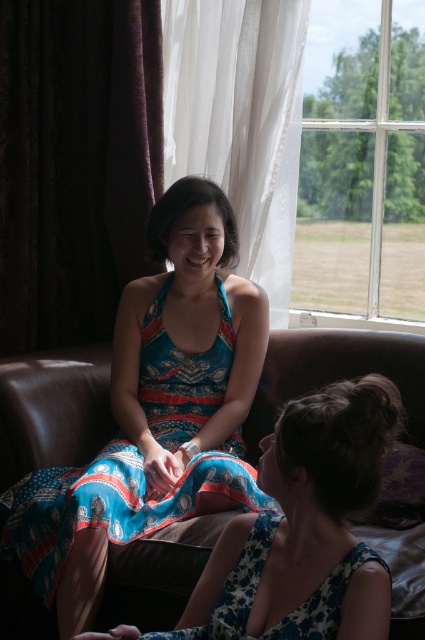
Does brown leather couch at center appear on the right side of blue printed dress at center?

In fact, brown leather couch at center is to the left of blue printed dress at center.

Does brown leather couch at center have a smaller size compared to blue printed dress at center?

Yes.

Find the location of a particular element. The width and height of the screenshot is (425, 640). brown leather couch at center is located at coordinates (53, 408).

The image size is (425, 640). I want to click on brown leather couch at center, so click(53, 408).

Is dark velvet curtain at left below floral fabric dress at lower center?

No, dark velvet curtain at left is not below floral fabric dress at lower center.

Does dark velvet curtain at left come in front of floral fabric dress at lower center?

That is False.

Find the location of a particular element. dark velvet curtain at left is located at coordinates [x=76, y=163].

Where is `dark velvet curtain at left`? Image resolution: width=425 pixels, height=640 pixels. dark velvet curtain at left is located at coordinates (76, 163).

Which is more to the left, brown leather couch at center or floral fabric dress at lower center?

brown leather couch at center is more to the left.

This screenshot has width=425, height=640. I want to click on brown leather couch at center, so click(x=53, y=408).

In order to click on brown leather couch at center in this screenshot , I will do `click(53, 408)`.